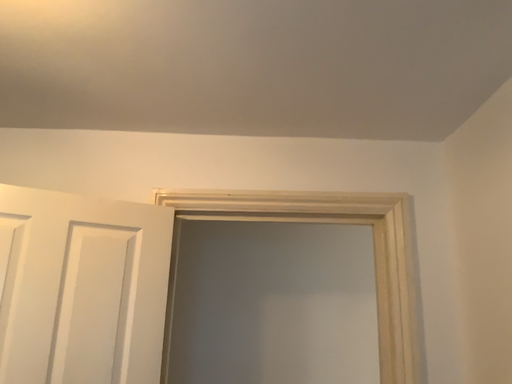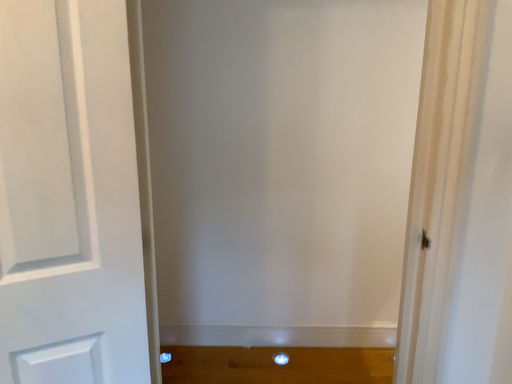
Question: How did the camera likely rotate when shooting the video?

Choices:
 (A) rotated downward
 (B) rotated upward

Answer: (A)